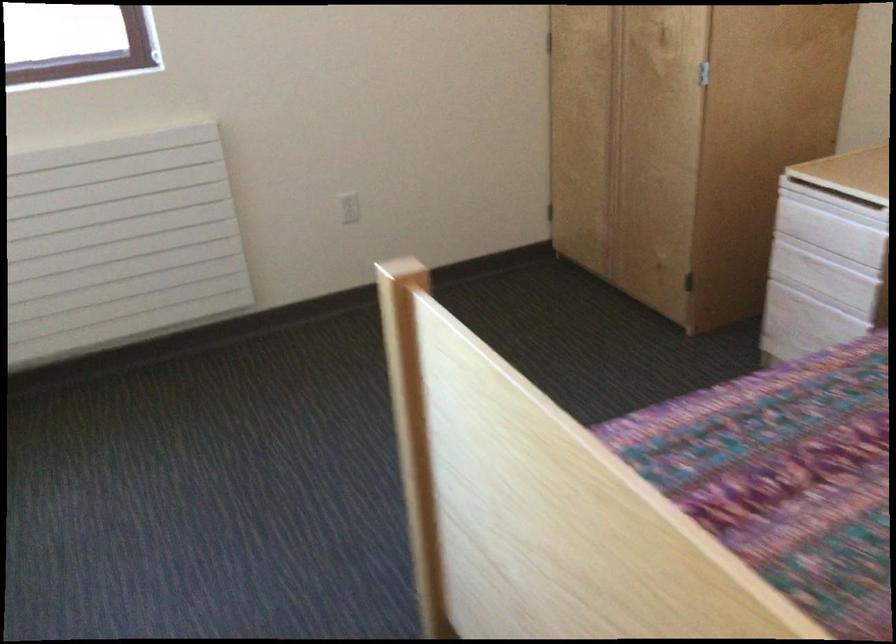
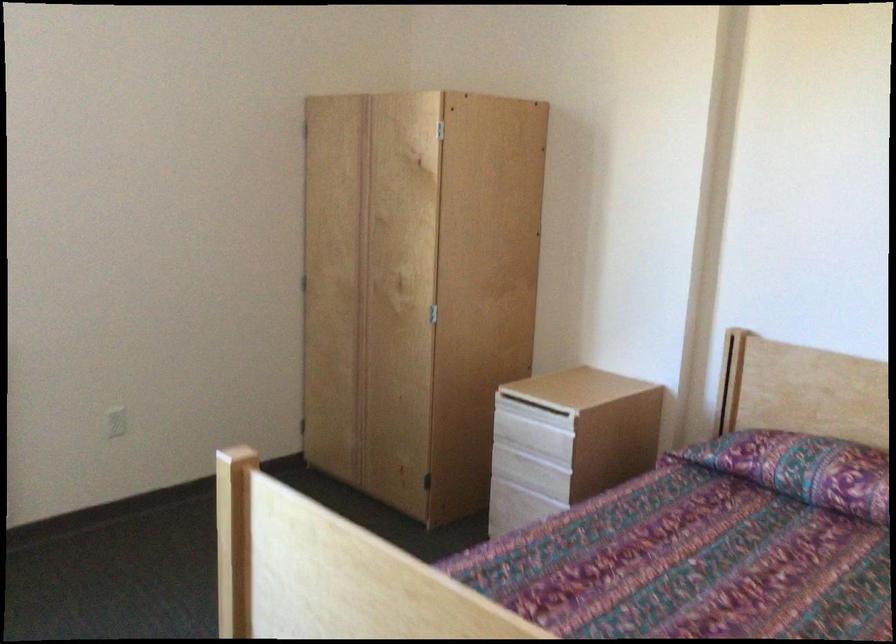
The images are taken continuously from a first-person perspective. In which direction are you moving?

The cameraman walked toward left, backward.